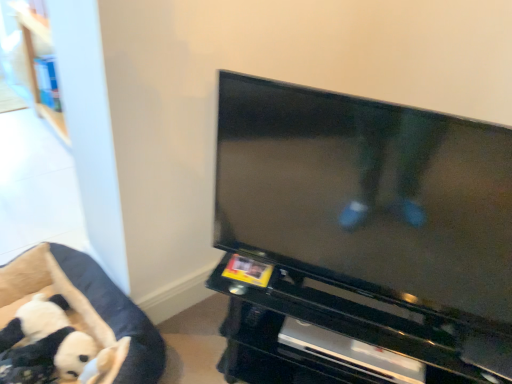
The image size is (512, 384). What are the coordinates of `blank area beneath black glossy tv at center (from a real-world perspective)` in the screenshot? It's located at (328, 291).